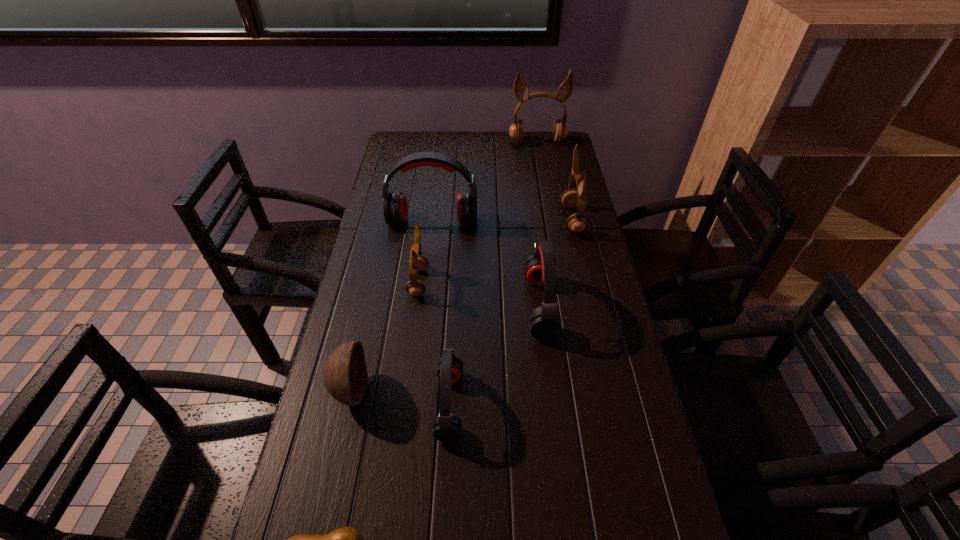
Select which red earphone is the second closest to the biggest red earphone. Please provide its 2D coordinates. Your answer should be formatted as a tuple, i.e. [(x, y)], where the tuple contains the x and y coordinates of a point satisfying the conditions above.

[(446, 426)]

Identify which red earphone is the second nearest to the second biggest red earphone. Please provide its 2D coordinates. Your answer should be formatted as a tuple, i.e. [(x, y)], where the tuple contains the x and y coordinates of a point satisfying the conditions above.

[(395, 207)]

At what (x,y) coordinates should I click in order to perform the action: click on free space that satisfies the following two spatial constraints: 1. on the front-facing side of the tallest object; 2. on the ear cups of the second biggest red earphone. Please return your answer as a coordinate pair (x, y). The image size is (960, 540). Looking at the image, I should click on (567, 306).

At what (x,y) coordinates should I click in order to perform the action: click on vacant area that satisfies the following two spatial constraints: 1. on the front-facing side of the biggest brown earphone; 2. on the ear cups of the second nearest red earphone. Please return your answer as a coordinate pair (x, y). Image resolution: width=960 pixels, height=540 pixels. Looking at the image, I should click on (567, 306).

Image resolution: width=960 pixels, height=540 pixels. Identify the location of free space in the image that satisfies the following two spatial constraints: 1. on the front-facing side of the tallest object; 2. on the ear cups of the rightmost red earphone. (567, 306).

Locate an element on the screen. Image resolution: width=960 pixels, height=540 pixels. free spot that satisfies the following two spatial constraints: 1. on the ear cups of the second nearest red earphone; 2. on the front side of the bowl is located at coordinates (551, 390).

Find the location of a particular element. Image resolution: width=960 pixels, height=540 pixels. vacant area in the image that satisfies the following two spatial constraints: 1. on the front-facing side of the farthest brown earphone; 2. on the front-facing side of the smallest brown earphone is located at coordinates (563, 282).